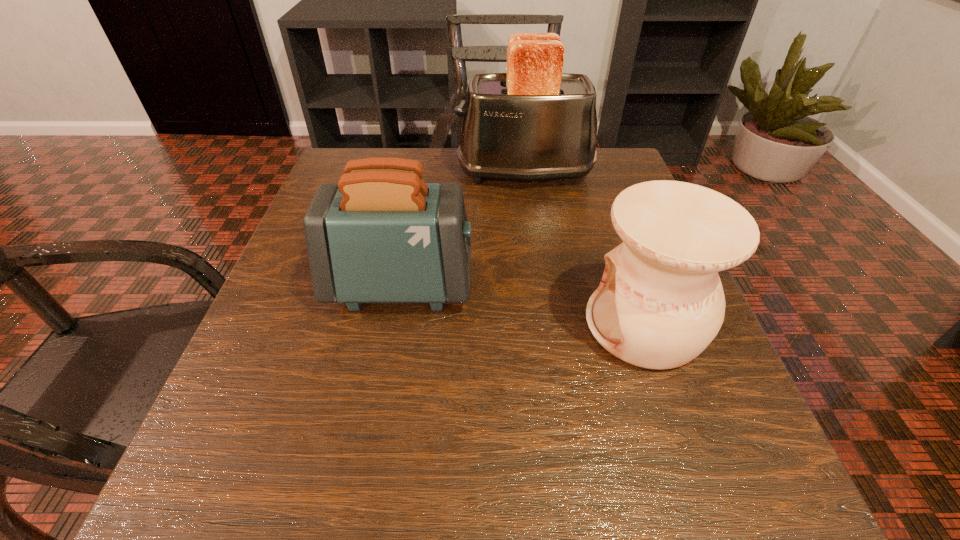
The width and height of the screenshot is (960, 540). I want to click on the taller toaster, so click(534, 122).

Where is `the farthest object`? This screenshot has width=960, height=540. the farthest object is located at coordinates (534, 122).

Where is `the shorter toaster`? the shorter toaster is located at coordinates (381, 234).

Find the location of a particular element. The image size is (960, 540). pottery is located at coordinates (660, 303).

At what (x,y) coordinates should I click in order to perform the action: click on free location located on the side of the tallest object with the control lever. Please return your answer as a coordinate pair (x, y). Looking at the image, I should click on (396, 172).

This screenshot has height=540, width=960. I want to click on vacant space located on the side of the tallest object with the control lever, so click(x=405, y=172).

Identify the location of free region located on the side of the tallest object with the control lever. The height and width of the screenshot is (540, 960). (358, 172).

Where is `vacant space located on the front-facing side of the shorter toaster`? The width and height of the screenshot is (960, 540). vacant space located on the front-facing side of the shorter toaster is located at coordinates (564, 286).

Where is `vacant space situated 0.400m at the open side of the pottery`? Image resolution: width=960 pixels, height=540 pixels. vacant space situated 0.400m at the open side of the pottery is located at coordinates (335, 324).

I want to click on vacant region located at the open side of the pottery, so click(x=447, y=324).